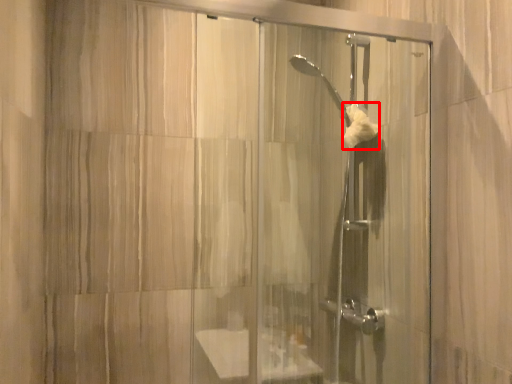
Question: Where is hand towel (annotated by the red box) located in relation to screen door in the image?

Choices:
 (A) right
 (B) left

Answer: (A)